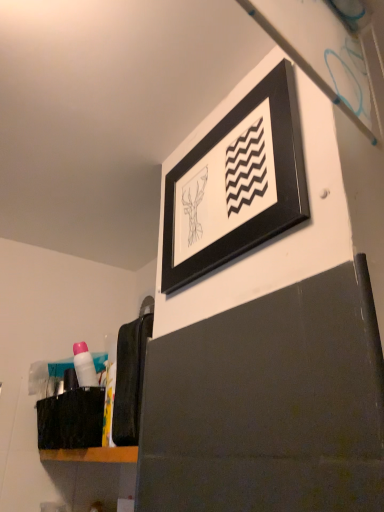
Question: Considering the positions of pink plastic tube at lower left and black matte picture frame at upper center in the image, is pink plastic tube at lower left bigger or smaller than black matte picture frame at upper center?

Choices:
 (A) small
 (B) big

Answer: (A)

Question: From the image's perspective, is pink plastic tube at lower left above or below black matte picture frame at upper center?

Choices:
 (A) above
 (B) below

Answer: (B)

Question: Which object is the farthest from the black fabric laundry at lower left?

Choices:
 (A) pink plastic tube at lower left
 (B) black matte picture frame at upper center

Answer: (B)

Question: Based on their relative distances, which object is nearer to the pink plastic tube at lower left?

Choices:
 (A) black matte picture frame at upper center
 (B) black fabric laundry at lower left

Answer: (B)